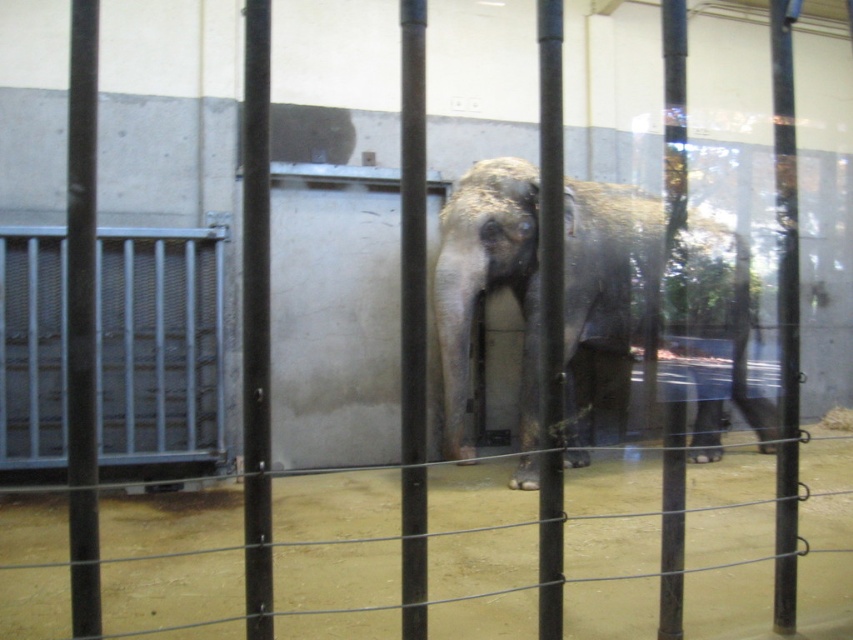
Question: Which object appears closest to the camera in this image?

Choices:
 (A) gray textured elephant at center
 (B) brushed metal gate at left

Answer: (A)

Question: Which point appears farthest from the camera in this image?

Choices:
 (A) (740, 257)
 (B) (65, 442)

Answer: (A)

Question: Does gray textured elephant at center appear on the right side of brushed metal gate at left?

Choices:
 (A) no
 (B) yes

Answer: (B)

Question: Observing the image, what is the correct spatial positioning of gray textured elephant at center in reference to brushed metal gate at left?

Choices:
 (A) left
 (B) right

Answer: (B)

Question: Does gray textured elephant at center have a greater width compared to brushed metal gate at left?

Choices:
 (A) yes
 (B) no

Answer: (A)